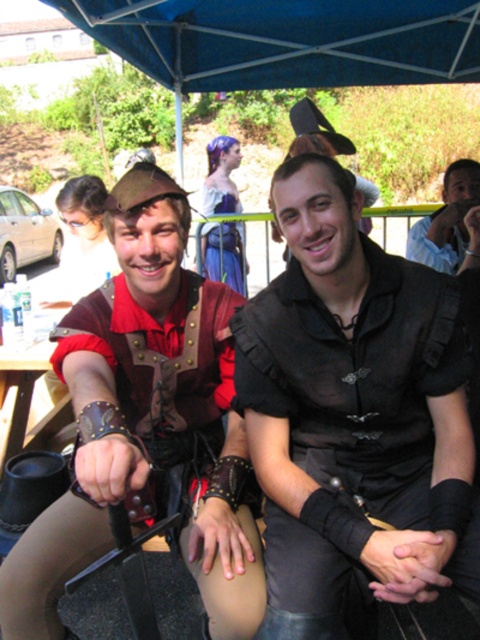
Is blue fabric canopy at upper center behind light blue shirt at center?

No, blue fabric canopy at upper center is closer to the viewer.

Is blue fabric canopy at upper center closer to the viewer compared to light blue shirt at center?

Yes.

Which is behind, point (224, 22) or point (437, 216)?

Positioned behind is point (224, 22).

This screenshot has width=480, height=640. In order to click on blue fabric canopy at upper center in this screenshot , I will do `click(287, 40)`.

Is leather/golden-brown armor at center wider than brown wooden picnic table at lower left?

Indeed, leather/golden-brown armor at center has a greater width compared to brown wooden picnic table at lower left.

Does leather/golden-brown armor at center come in front of brown wooden picnic table at lower left?

Yes.

Does point (232, 515) lie in front of point (59, 429)?

Yes, point (232, 515) is closer to viewer.

I want to click on leather/golden-brown armor at center, so click(x=146, y=422).

Who is positioned more to the right, leather/golden-brown armor at center or light blue shirt at center?

light blue shirt at center is more to the right.

Does leather/golden-brown armor at center appear on the left side of light blue shirt at center?

Correct, you'll find leather/golden-brown armor at center to the left of light blue shirt at center.

Which is in front, point (132, 401) or point (437, 221)?

Point (132, 401) is in front.

You are a GUI agent. You are given a task and a screenshot of the screen. Output one action in this format:
    pyautogui.click(x=<x>, y=<y>)
    Task: Click on the leather/golden-brown armor at center
    
    Given the screenshot: What is the action you would take?
    pyautogui.click(x=146, y=422)